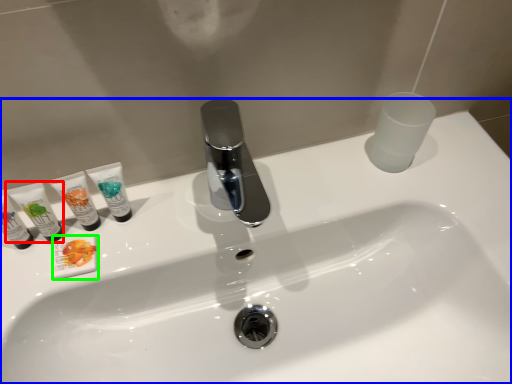
Question: Which object is the closest to the toiletry (highlighted by a red box)? Choose among these: sink (highlighted by a blue box) or toiletry (highlighted by a green box).

Choices:
 (A) sink
 (B) toiletry

Answer: (B)